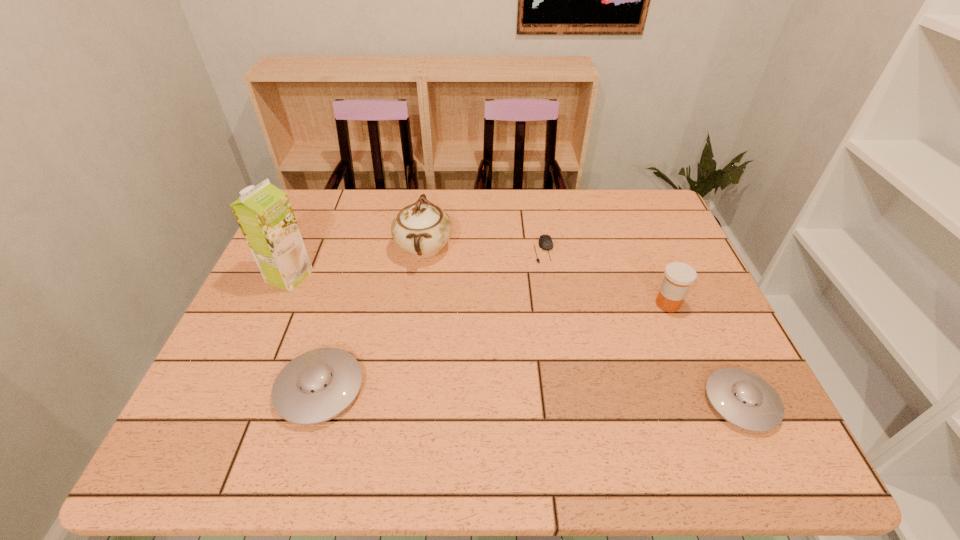
This screenshot has width=960, height=540. I want to click on object that is at the far edge, so click(x=422, y=229).

Where is `saucer situated at the left edge`? The height and width of the screenshot is (540, 960). saucer situated at the left edge is located at coordinates (316, 386).

I want to click on soya milk that is at the left edge, so click(x=264, y=213).

Find the location of `saucer located at the right edge`. saucer located at the right edge is located at coordinates (742, 398).

In order to click on medicine that is positioned at the right edge in this screenshot , I will do `click(679, 276)`.

In order to click on object at the near left corner in this screenshot , I will do `click(316, 386)`.

Find the location of a particular element. The width and height of the screenshot is (960, 540). object that is at the near right corner is located at coordinates (742, 398).

The image size is (960, 540). What are the coordinates of `vacant space at the far edge of the desktop` in the screenshot? It's located at (526, 195).

Where is `vacant area at the near edge of the desktop`? The width and height of the screenshot is (960, 540). vacant area at the near edge of the desktop is located at coordinates (455, 413).

The width and height of the screenshot is (960, 540). What are the coordinates of `vacant area at the left edge` in the screenshot? It's located at (223, 356).